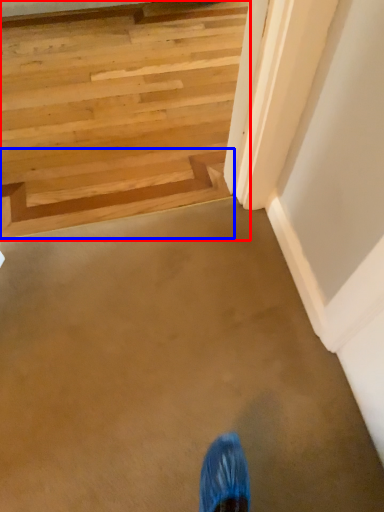
Question: Which point is closer to the camera, stairs (highlighted by a red box) or stairwell (highlighted by a blue box)?

Choices:
 (A) stairs
 (B) stairwell

Answer: (A)